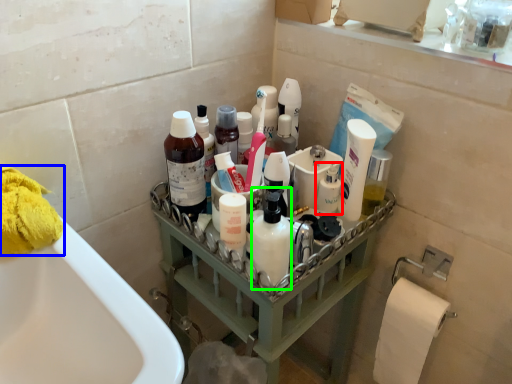
Question: Which object is positioned closest to toiletry (highlighted by a red box)? Select from toilet paper (highlighted by a blue box) and cleaning product (highlighted by a green box).

Choices:
 (A) toilet paper
 (B) cleaning product

Answer: (B)